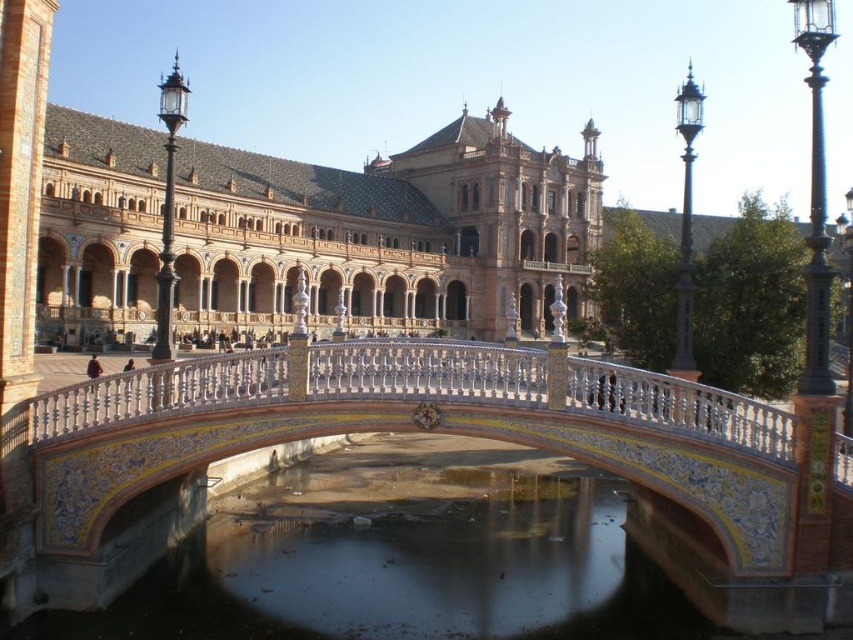
Question: From the image, what is the correct spatial relationship of smooth concrete river at center in relation to decorative ceramic bridge at center?

Choices:
 (A) right
 (B) left

Answer: (B)

Question: Does smooth concrete river at center come in front of decorative ceramic bridge at center?

Choices:
 (A) yes
 (B) no

Answer: (A)

Question: Which object is closer to the camera taking this photo?

Choices:
 (A) smooth concrete river at center
 (B) decorative ceramic bridge at center

Answer: (A)

Question: Among these objects, which one is farthest from the camera?

Choices:
 (A) smooth concrete river at center
 (B) decorative ceramic bridge at center

Answer: (B)

Question: Is smooth concrete river at center wider than decorative ceramic bridge at center?

Choices:
 (A) no
 (B) yes

Answer: (A)